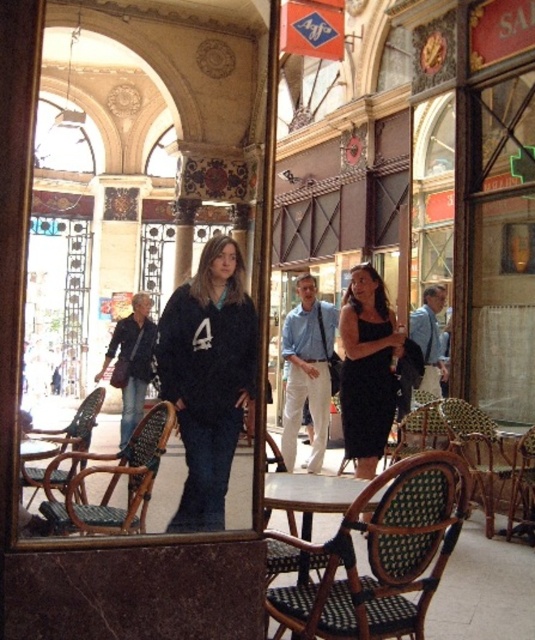
Question: Which of these objects is positioned closest to the black satin dress at center?

Choices:
 (A) green woven table at center
 (B) green woven chair at lower right

Answer: (B)

Question: Does woven rattan chair at lower right have a lesser width compared to blue denim jeans at center?

Choices:
 (A) no
 (B) yes

Answer: (A)

Question: Which of the following is the closest to the observer?

Choices:
 (A) green woven table at center
 (B) denim jacket at left
 (C) green woven chair at lower right
 (D) black matte sweatshirt at center

Answer: (A)

Question: Which of these objects is positioned closest to the green woven chair at lower right?

Choices:
 (A) light blue cotton shirt at center
 (B) rattan chair at center
 (C) blue denim jeans at center

Answer: (C)

Question: Can you confirm if woven rattan chair at lower right is thinner than green woven chair at lower right?

Choices:
 (A) no
 (B) yes

Answer: (A)

Question: Does woven rattan chair at lower center have a smaller size compared to green woven table at center?

Choices:
 (A) yes
 (B) no

Answer: (B)